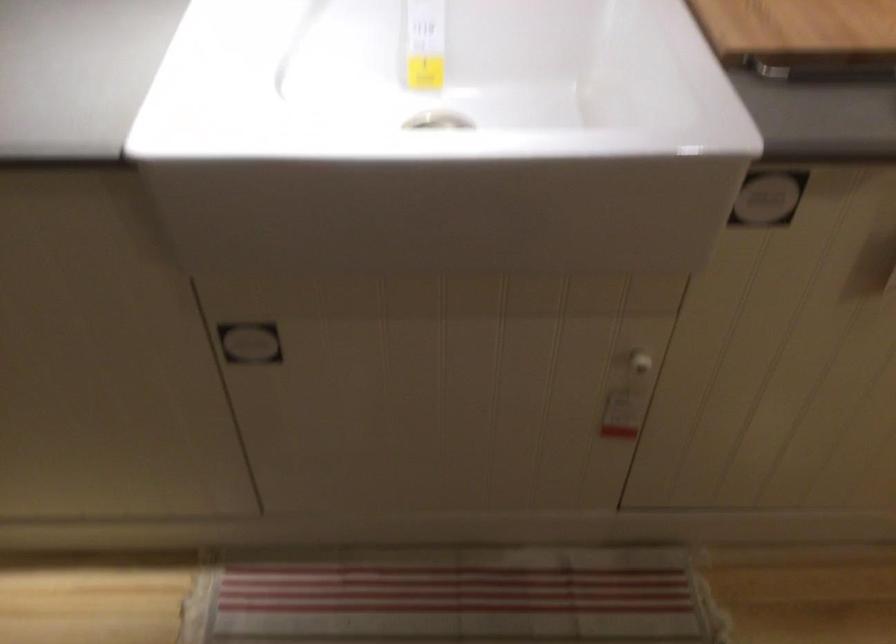
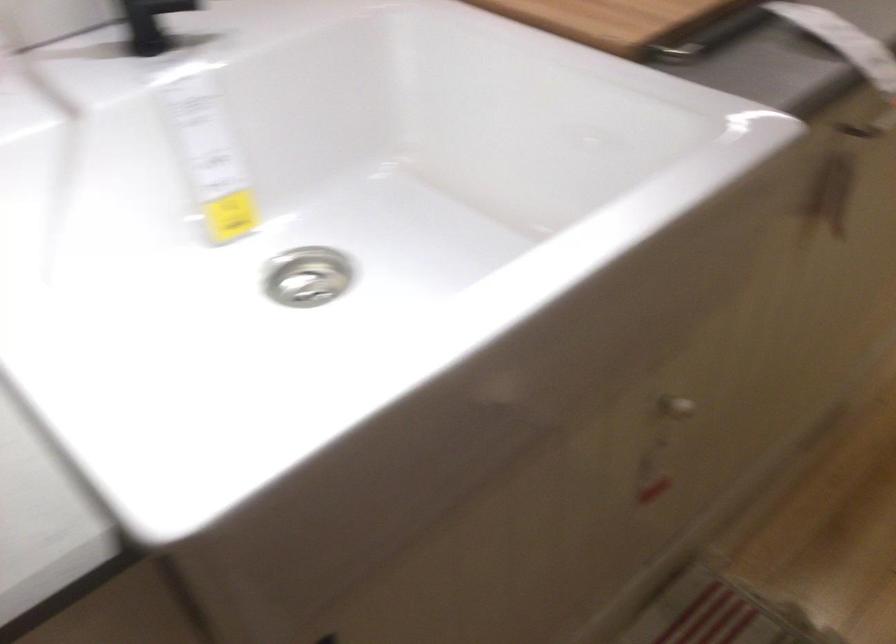
The point at (x=639, y=363) is marked in the first image. Where is the corresponding point in the second image?

(675, 408)